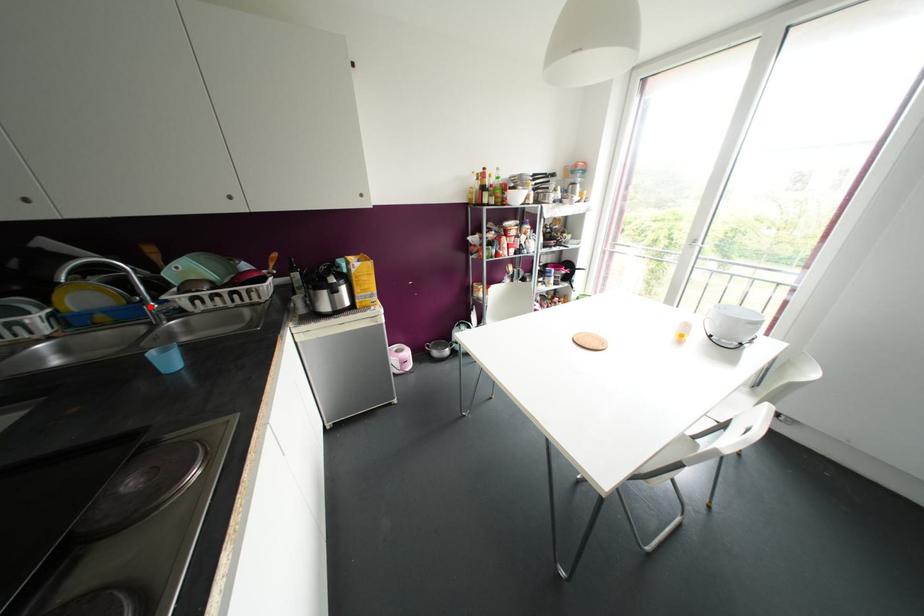
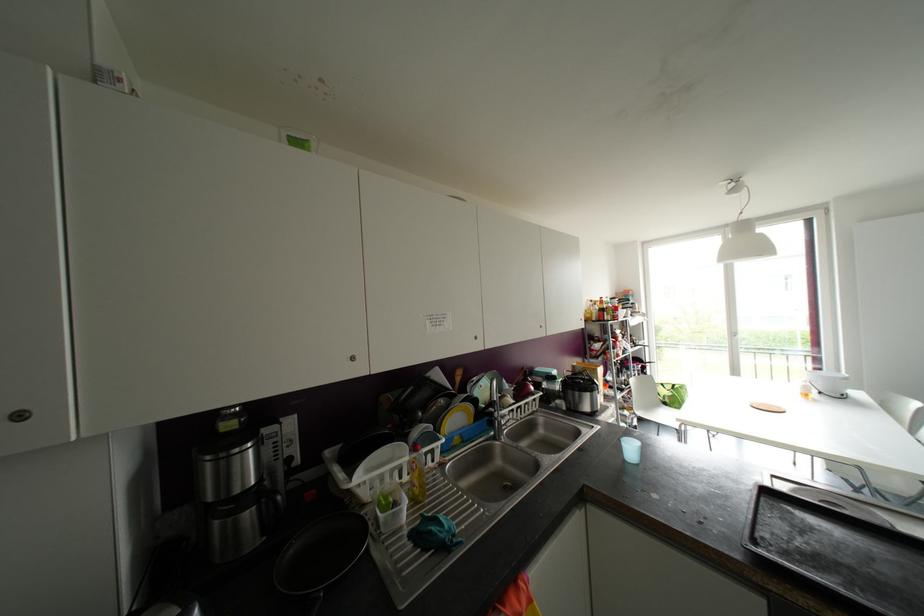
Locate, in the second image, the point that corresponds to the highlighted location in the first image.

(499, 422)